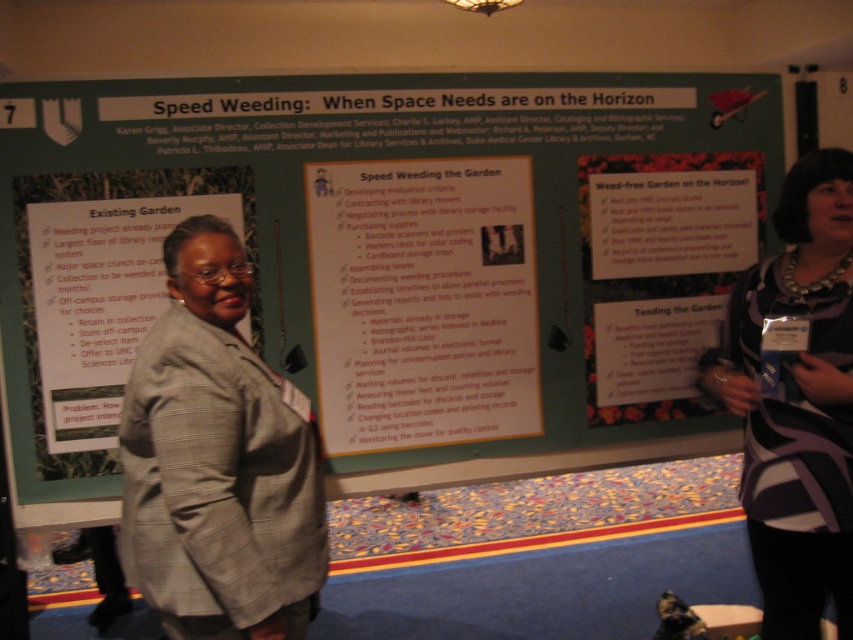
Which is in front, point (628, 234) or point (489, 428)?

Point (489, 428)

Is green matte poster at center taller than orange paper poster at center?

Yes, green matte poster at center is taller than orange paper poster at center.

Between point (585, 349) and point (416, 332), which one is positioned in front?

Point (416, 332) is more forward.

Where is `green matte poster at center`? The width and height of the screenshot is (853, 640). green matte poster at center is located at coordinates (389, 260).

Is green matte poster at center wider than white paper poster at center?

Indeed, green matte poster at center has a greater width compared to white paper poster at center.

Which is in front, point (329, 330) or point (96, 273)?

Point (96, 273)

Identify the location of green matte poster at center. (389, 260).

Between point (202, 554) and point (813, 442), which one is positioned in front?

Point (202, 554) is in front.

Locate an element on the screen. This screenshot has width=853, height=640. gray plaid blazer at center is located at coordinates (218, 460).

This screenshot has height=640, width=853. Describe the element at coordinates (218, 460) in the screenshot. I see `gray plaid blazer at center` at that location.

Locate an element on the screen. gray plaid blazer at center is located at coordinates (218, 460).